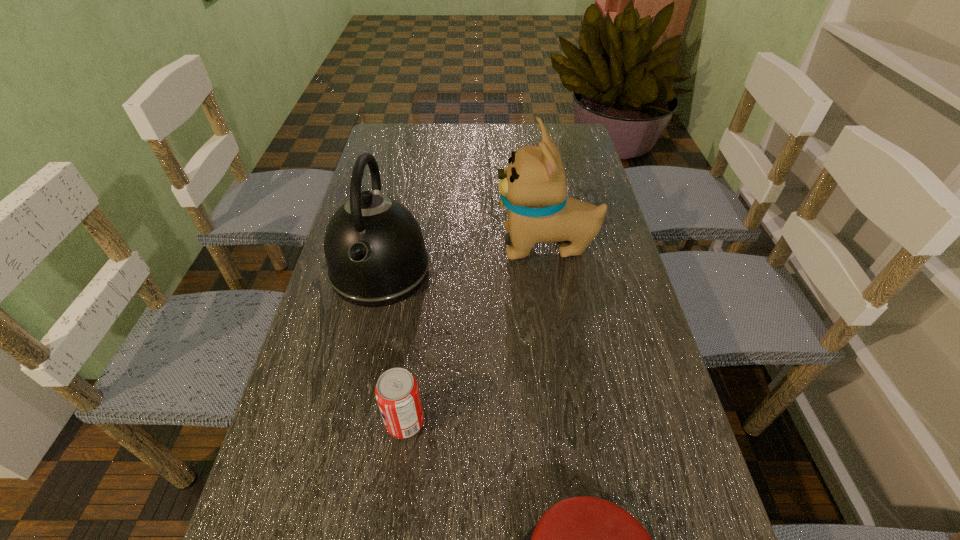
Locate an element on the screen. The image size is (960, 540). puppy is located at coordinates (533, 188).

You are a GUI agent. You are given a task and a screenshot of the screen. Output one action in this format:
    pyautogui.click(x=<x>, y=<y>)
    Task: Click on the kettle
    This screenshot has width=960, height=540.
    Given the screenshot: What is the action you would take?
    pyautogui.click(x=375, y=252)

Identify the location of the third farthest object. This screenshot has width=960, height=540. (397, 393).

The width and height of the screenshot is (960, 540). Find the location of `the third tallest object`. the third tallest object is located at coordinates (397, 393).

Locate an element on the screen. Image resolution: width=960 pixels, height=540 pixels. free spot located on the face of the puppy is located at coordinates pos(350,245).

Locate an element on the screen. free space located 0.060m on the face of the puppy is located at coordinates (473, 245).

Where is `free region located on the face of the puppy`? The image size is (960, 540). free region located on the face of the puppy is located at coordinates (354, 245).

Find the location of a particular element. The image size is (960, 540). vacant space situated on the spout of the kettle is located at coordinates (330, 498).

You are a GUI agent. You are given a task and a screenshot of the screen. Output one action in this format:
    pyautogui.click(x=<x>, y=<y>)
    Task: Click on the free spot located 0.160m on the left of the soda can
    The height and width of the screenshot is (540, 960).
    Given the screenshot: What is the action you would take?
    pyautogui.click(x=301, y=423)

At what (x,y) coordinates should I click in order to perform the action: click on object that is at the left edge. Please return your answer as a coordinate pair (x, y). Looking at the image, I should click on (375, 252).